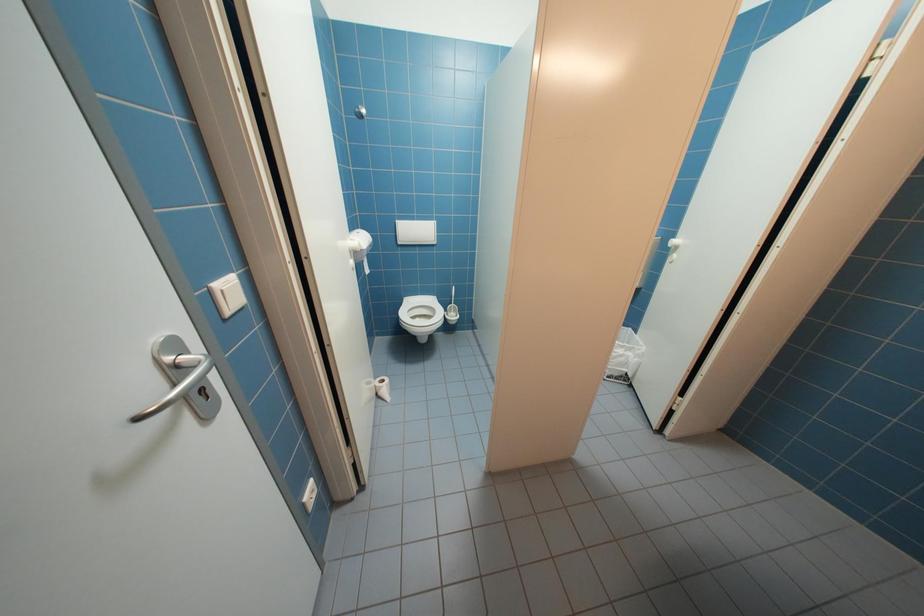
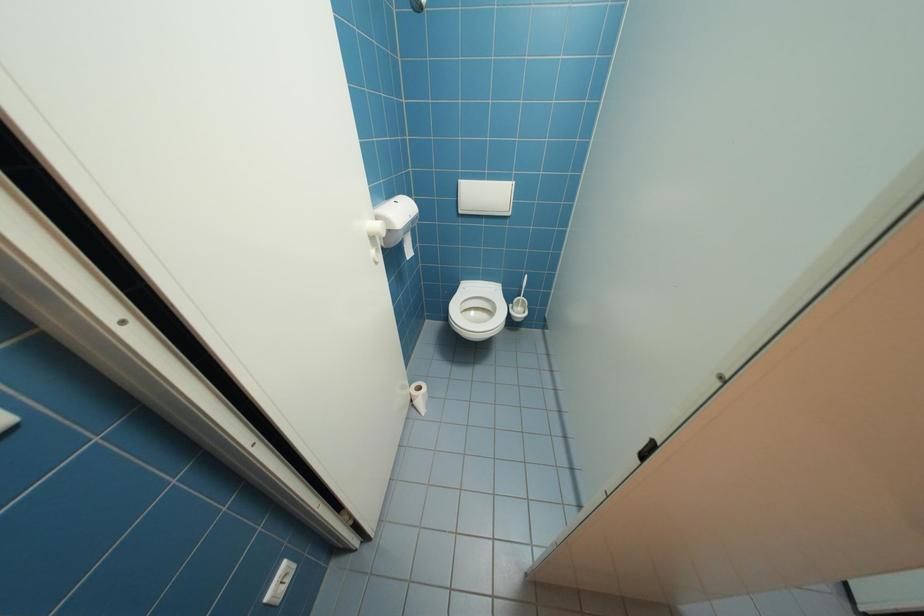
Question: The images are taken continuously from a first-person perspective. In which direction is your viewpoint rotating?

Choices:
 (A) Left
 (B) Right
 (C) Up
 (D) Down

Answer: (A)